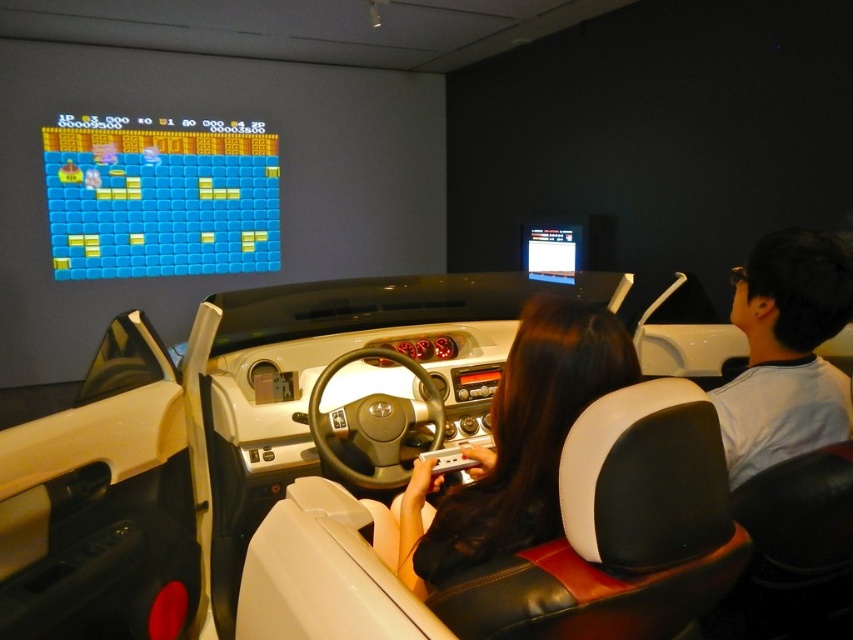
Question: Can you confirm if white leather car at center is positioned above black leather hair at center?

Choices:
 (A) yes
 (B) no

Answer: (A)

Question: Among these objects, which one is nearest to the camera?

Choices:
 (A) gray cotton shirt at right
 (B) black leather car seat at center
 (C) black leather hair at center
 (D) white leather car at center

Answer: (C)

Question: Which object is closer to the camera taking this photo?

Choices:
 (A) gray cotton shirt at right
 (B) black leather hair at center

Answer: (B)

Question: Does black leather hair at center have a larger size compared to gray cotton shirt at right?

Choices:
 (A) yes
 (B) no

Answer: (A)

Question: Considering the real-world distances, which object is closest to the gray cotton shirt at right?

Choices:
 (A) black leather car seat at center
 (B) black leather hair at center

Answer: (A)

Question: Is black leather hair at center positioned at the back of gray cotton shirt at right?

Choices:
 (A) no
 (B) yes

Answer: (A)